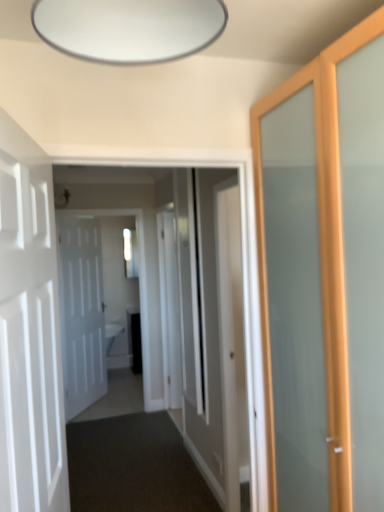
The height and width of the screenshot is (512, 384). Describe the element at coordinates (117, 397) in the screenshot. I see `white glossy door at center, positioned as the first path in back-to-front order` at that location.

How much space does white glossy door at center, positioned as the first path in back-to-front order, occupy vertically?

white glossy door at center, positioned as the first path in back-to-front order, is 6.83 inches in height.

Locate an element on the screen. white matte door at left, the first door positioned from the left is located at coordinates (82, 314).

Locate an element on the screen. Image resolution: width=384 pixels, height=512 pixels. white glossy door at center, the 3th door positioned from the left is located at coordinates (232, 343).

The image size is (384, 512). In order to click on clear glass door at center in this screenshot , I will do `click(129, 252)`.

Identify the location of dark carpet at center, which is counted as the 2th path, starting from the back. The width and height of the screenshot is (384, 512). (131, 456).

This screenshot has width=384, height=512. Identify the location of door that is the 1st one when counting upward from the white glossy door at center, marked as the 2th path in a front-to-back arrangement (from the image's perspective). (82, 314).

Between white matte door at left, the 1th door positioned from the back, and white glossy door at center, marked as the 2th path in a front-to-back arrangement, which one has more height?

Standing taller between the two is white matte door at left, the 1th door positioned from the back.

Is white matte door at left, the first door positioned from the left, completely or partially outside of white glossy door at center, positioned as the first path in back-to-front order?

Indeed, white matte door at left, the first door positioned from the left, is completely outside white glossy door at center, positioned as the first path in back-to-front order.

From their relative heights in the image, would you say white glossy door at center is taller or shorter than white glossy door at center?

Considering their sizes, white glossy door at center has more height than white glossy door at center.

Which object is closer to the camera taking this photo, white glossy door at center or white glossy door at center?

white glossy door at center is more forward.

From a real-world perspective, is white glossy door at center physically below white glossy door at center?

Correct, in the physical world, white glossy door at center is lower than white glossy door at center.

Is white glossy door at center to the left or to the right of white glossy door at center in the image?

white glossy door at center is to the left of white glossy door at center.

From a real-world perspective, is white glossy door at center physically located above or below white matte door at left, the 2th door viewed from the right?

Clearly, from a real-world perspective, white glossy door at center is below white matte door at left, the 2th door viewed from the right.

Does white glossy door at center have a lesser height compared to white matte door at left, the 2th door in the left-to-right sequence?

No, white glossy door at center is not shorter than white matte door at left, the 2th door in the left-to-right sequence.

What's the angular difference between white glossy door at center and white matte door at left, which is the 3th door in back-to-front order,'s facing directions?

white glossy door at center and white matte door at left, which is the 3th door in back-to-front order, are facing 172 degrees away from each other.

In the scene shown: Can you confirm if clear glass door at center is smaller than white glossy door at center?

Yes, clear glass door at center is smaller than white glossy door at center.

Between clear glass door at center and white glossy door at center, which one appears on the left side from the viewer's perspective?

From the viewer's perspective, clear glass door at center appears more on the left side.

From a real-world perspective, between clear glass door at center and white glossy door at center, who is vertically lower?

white glossy door at center, from a real-world perspective.

Is white matte door at left, the 2th door in the left-to-right sequence, to the right of clear glass door at center from the viewer's perspective?

Yes.

From a real-world perspective, starting from the clear glass door at center, which door is the 1st one below it? Please provide its 2D coordinates.

[(30, 345)]

Is white matte door at left, the first door when ordered from front to back, positioned beyond the bounds of clear glass door at center?

Yes, white matte door at left, the first door when ordered from front to back, is located beyond the bounds of clear glass door at center.

Is white glossy door at center, the second door from the back, located outside dark carpet at center, marked as the 1th path in a front-to-back arrangement?

white glossy door at center, the second door from the back, lies outside dark carpet at center, marked as the 1th path in a front-to-back arrangement,'s area.

From a real-world perspective, which path is the 1st one underneath the white glossy door at center, arranged as the second door when viewed from the front? Please provide its 2D coordinates.

[(131, 456)]

Based on the photo, how much distance is there between white glossy door at center, the second door from the back, and dark carpet at center, marked as the 1th path in a front-to-back arrangement?

3.76 feet.

From a real-world perspective, does white glossy door at center, the 3th door positioned from the left, sit lower than dark carpet at center, marked as the 1th path in a front-to-back arrangement?

No.

Are white glossy door at center and dark carpet at center, marked as the 1th path in a front-to-back arrangement, far apart?

No, white glossy door at center is not far from dark carpet at center, marked as the 1th path in a front-to-back arrangement.

In the scene shown: Which is correct: white glossy door at center is inside dark carpet at center, marked as the 1th path in a front-to-back arrangement, or outside of it?

The correct answer is: outside.

Which of these two, white glossy door at center or dark carpet at center, which is counted as the 2th path, starting from the back, stands shorter?

Standing shorter between the two is dark carpet at center, which is counted as the 2th path, starting from the back.

Starting from the white matte door at left, which appears as the third door when viewed from the right, which path is the 1st one to the right? Please provide its 2D coordinates.

[(117, 397)]

At what (x,y) coordinates should I click in order to perform the action: click on screen door below the white glossy door at center (from a real-world perspective). Please return your answer as a coordinate pair (x, y). Looking at the image, I should click on pos(169,310).

Considering their positions, is dark carpet at center, marked as the 1th path in a front-to-back arrangement, positioned further to clear glass door at center than white matte door at left, the 1th door positioned from the back?

Among the two, dark carpet at center, marked as the 1th path in a front-to-back arrangement, is located further to clear glass door at center.

Considering their positions, is white glossy door at center positioned further to white matte door at left, the first door positioned from the left, than white glossy door at center, positioned as the first path in back-to-front order?

Among the two, white glossy door at center is located further to white matte door at left, the first door positioned from the left.

Which object lies further to the anchor point white matte door at left, the first door positioned from the left, clear glass door at center or white glossy door at center?

Based on the image, white glossy door at center appears to be further to white matte door at left, the first door positioned from the left.

Based on their spatial positions, is white glossy door at center, marked as the 2th path in a front-to-back arrangement, or clear glass door at center further from white glossy door at center?

The object further to white glossy door at center is white glossy door at center, marked as the 2th path in a front-to-back arrangement.

When comparing their distances from white matte door at left, the first door positioned from the left, does white glossy door at center, arranged as the second door when viewed from the front, or white glossy door at center, marked as the 2th path in a front-to-back arrangement, seem further?

white glossy door at center, arranged as the second door when viewed from the front, lies further to white matte door at left, the first door positioned from the left, than the other object.

Considering their positions, is white glossy door at center positioned closer to clear glass door at center than white matte door at left, the 1th door positioned from the back?

white matte door at left, the 1th door positioned from the back, is positioned closer to the anchor clear glass door at center.

Based on the photo, estimate the real-world distances between objects in this image. Which object is further from clear glass door at center, white glossy door at center, marked as the 2th path in a front-to-back arrangement, or white glossy door at center?

Among the two, white glossy door at center, marked as the 2th path in a front-to-back arrangement, is located further to clear glass door at center.

Looking at the image, which one is located further to white glossy door at center, white matte door at left, the 2th door in the left-to-right sequence, or white glossy door at center, the second door from the back?

The object further to white glossy door at center is white matte door at left, the 2th door in the left-to-right sequence.

Find the location of a particular element. The height and width of the screenshot is (512, 384). path between white glossy door at center, which is the 1th door in right-to-left order, and white matte door at left, the first door positioned from the left, along the z-axis is located at coordinates (131, 456).

You are a GUI agent. You are given a task and a screenshot of the screen. Output one action in this format:
    pyautogui.click(x=<x>, y=<y>)
    Task: Click on the path between white glossy door at center and white glossy door at center from front to back
    The height and width of the screenshot is (512, 384).
    Given the screenshot: What is the action you would take?
    pyautogui.click(x=131, y=456)

Locate an element on the screen. path between white glossy door at center, the second door from the back, and white glossy door at center from front to back is located at coordinates (131, 456).

Image resolution: width=384 pixels, height=512 pixels. Identify the location of path positioned between white matte door at left, the first door when ordered from front to back, and white glossy door at center, marked as the 2th path in a front-to-back arrangement, from near to far. (131, 456).